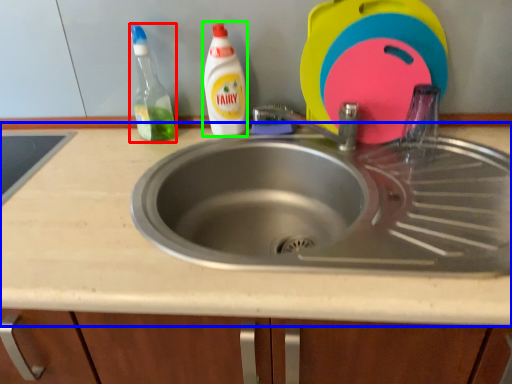
Question: Which object is the closest to the cleaning product (highlighted by a red box)? Choose among these: countertop (highlighted by a blue box) or cleaning product (highlighted by a green box).

Choices:
 (A) countertop
 (B) cleaning product

Answer: (B)